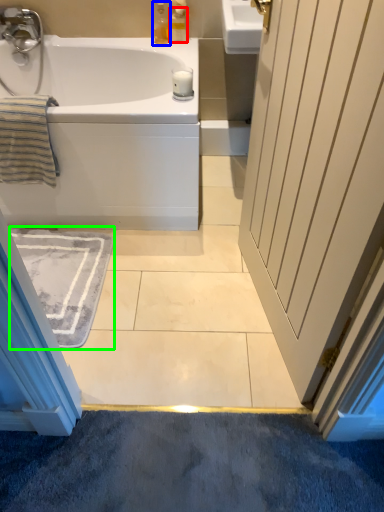
Question: Which object is the farthest from toiletry (highlighted by a red box)? Choose among these: soap dispenser (highlighted by a blue box) or bath mat (highlighted by a green box).

Choices:
 (A) soap dispenser
 (B) bath mat

Answer: (B)